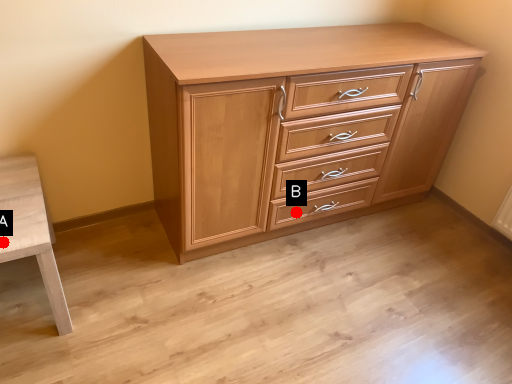
Question: Two points are circled on the image, labeled by A and B beside each circle. Which of the following is the farthest from the observer?

Choices:
 (A) A is further
 (B) B is further

Answer: (B)